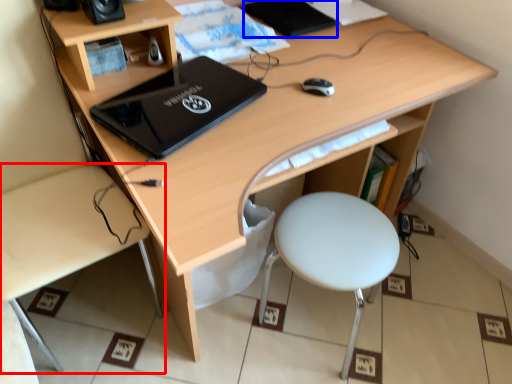
Question: Which of the following is the farthest to the observer, desk (highlighted by a red box) or notebook (highlighted by a blue box)?

Choices:
 (A) desk
 (B) notebook

Answer: (B)